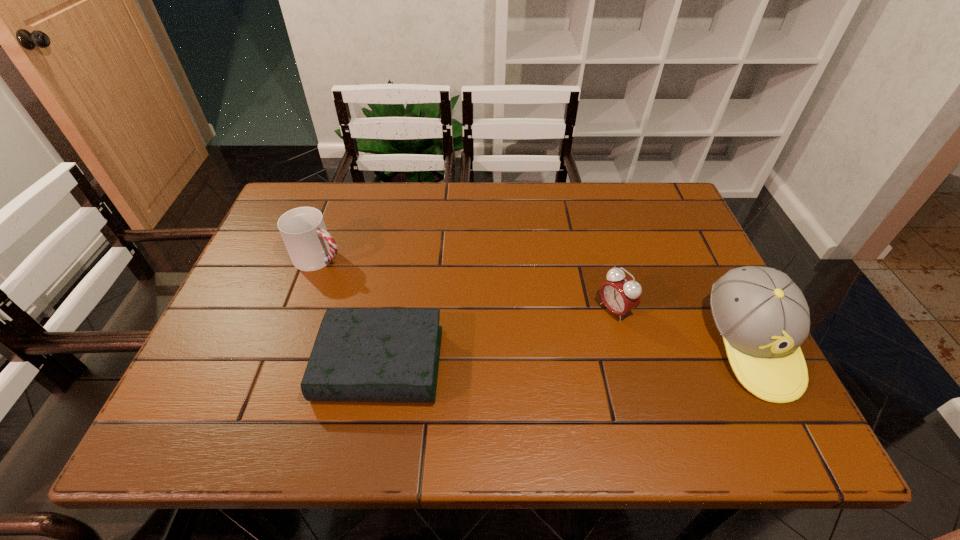
This screenshot has height=540, width=960. I want to click on free space located on the handle side of the leftmost object, so click(x=409, y=293).

At what (x,y) coordinates should I click in order to perform the action: click on vacant position located 0.100m on the clock face of the second object from right to left. Please return your answer as a coordinate pair (x, y). The height and width of the screenshot is (540, 960). Looking at the image, I should click on pyautogui.click(x=570, y=339).

At what (x,y) coordinates should I click in order to perform the action: click on free location located 0.120m on the clock face of the second object from right to left. Please return your answer as a coordinate pair (x, y). The image size is (960, 540). Looking at the image, I should click on (563, 342).

Identify the location of free space located on the clock face of the second object from right to left. Image resolution: width=960 pixels, height=540 pixels. (488, 388).

In order to click on Bible that is at the near edge in this screenshot , I will do `click(360, 354)`.

At what (x,y) coordinates should I click in order to perform the action: click on baseball cap that is at the near edge. Please return your answer as a coordinate pair (x, y). Image resolution: width=960 pixels, height=540 pixels. Looking at the image, I should click on (763, 317).

Locate an element on the screen. This screenshot has height=540, width=960. object at the left edge is located at coordinates (310, 247).

This screenshot has height=540, width=960. I want to click on object positioned at the right edge, so click(763, 317).

What are the coordinates of `object that is at the near right corner` in the screenshot? It's located at (763, 317).

You are a GUI agent. You are given a task and a screenshot of the screen. Output one action in this format:
    pyautogui.click(x=<x>, y=<y>)
    Task: Click on the vacant space at the far edge of the desktop
    This screenshot has width=960, height=540.
    Given the screenshot: What is the action you would take?
    coord(382,196)